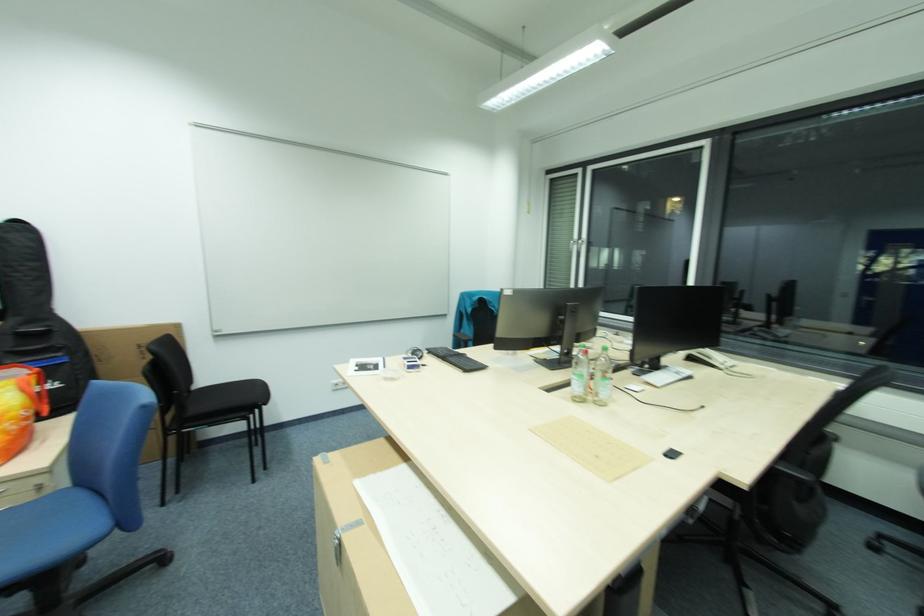
Describe the element at coordinates (714, 360) in the screenshot. I see `the white telephone handset` at that location.